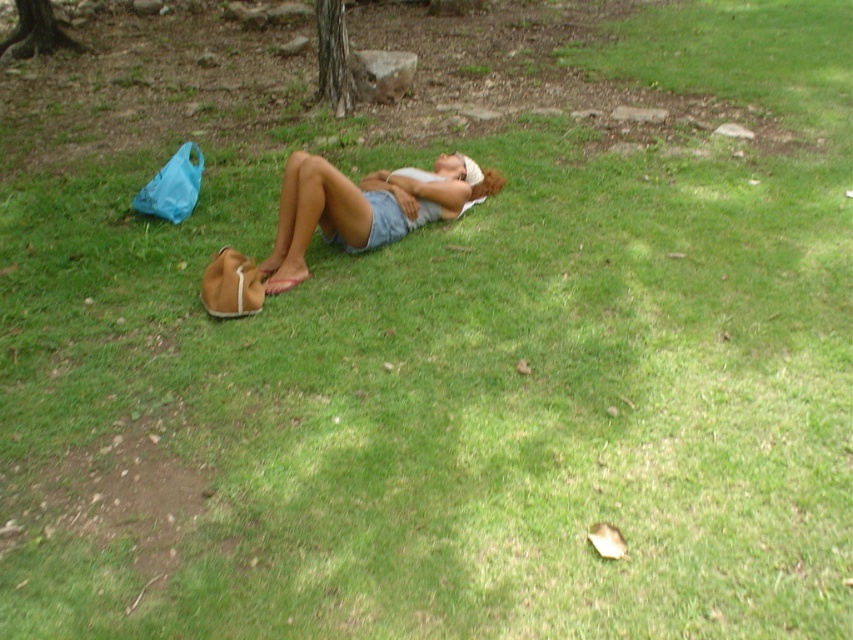
You are a hiker who wants to take a photo of both the brown textured tree trunk at upper center and the brown textured tree trunk at upper left in the same frame. Which tree trunk should you focus on first to ensure both are in the frame?

You should focus on the brown textured tree trunk at upper center first since it is taller than the brown textured tree trunk at upper left, allowing you to frame both by adjusting your camera angle to include the shorter one below it.

You are a hiker who wants to take a photo of both the brown textured tree trunk at upper center and the brown textured tree trunk at upper left. Which tree trunk should you focus on first to ensure both are in the frame?

You should focus on the brown textured tree trunk at upper left first because it is larger and closer to the camera, making it easier to frame both trunks in the photo.